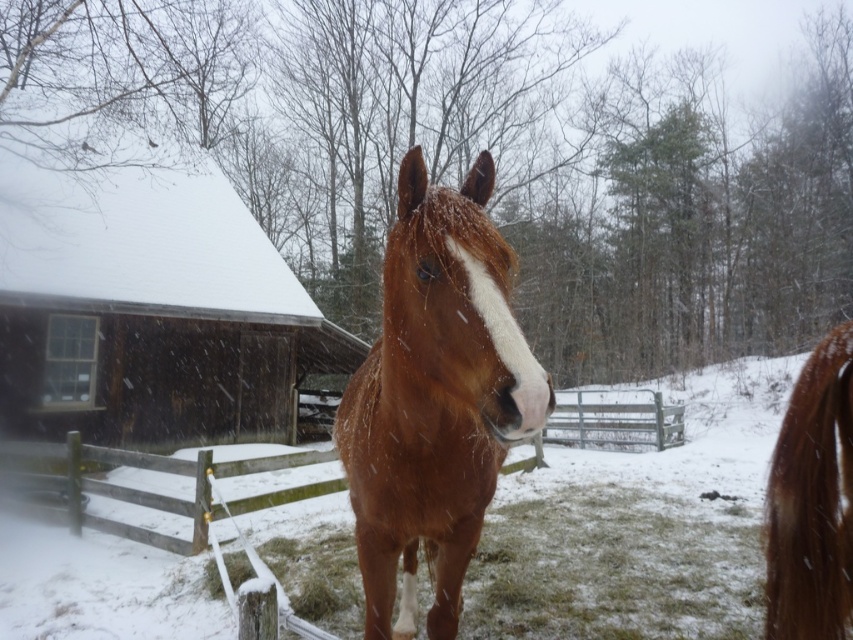
Question: Which object appears closest to the camera in this image?

Choices:
 (A) green grass at center
 (B) brown glossy horse at center
 (C) brown glossy horse at right

Answer: (B)

Question: Estimate the real-world distances between objects in this image. Which object is farther from the brown glossy horse at right?

Choices:
 (A) brown glossy horse at center
 (B) green grass at center
 (C) dark brown wooden barn at left
 (D) wooden at center

Answer: (C)

Question: Does dark brown wooden barn at left have a greater width compared to brown glossy horse at right?

Choices:
 (A) yes
 (B) no

Answer: (A)

Question: Where is dark brown wooden barn at left located in relation to wooden at center in the image?

Choices:
 (A) above
 (B) below

Answer: (A)

Question: Observing the image, what is the correct spatial positioning of dark brown wooden barn at left in reference to wooden at center?

Choices:
 (A) below
 (B) above

Answer: (B)

Question: Among these points, which one is nearest to the camera?

Choices:
 (A) (392, 365)
 (B) (210, 285)
 (C) (537, 444)
 (D) (718, 593)

Answer: (A)